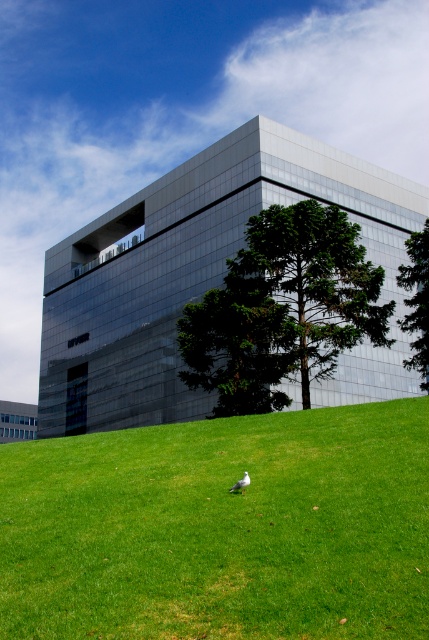
You are standing in front of the modern building and want to walk towards the green leafy tree at center and the green leafy tree at right. Which tree will you encounter first based on their positions?

The green leafy tree at center will be encountered first because it is positioned below the green leafy tree at right, meaning it is closer to the observer.

You are standing at the base of the green leafy tree at right and want to see the top of the green grassy at lower center. Can you see it without moving your head?

The green grassy at lower center is shorter than the green leafy tree at right, so yes, you can see the top of the green grassy at lower center without moving your head because it is shorter than the tree.

You are a landscape architect designing a pathway between the green leafy tree at center and the green leafy tree at right. Which tree has a trunk that is narrower and would require a narrower path design?

The green leafy tree at center is thinner than the green leafy tree at right, so the path near the green leafy tree at center should be narrower to accommodate its trunk.